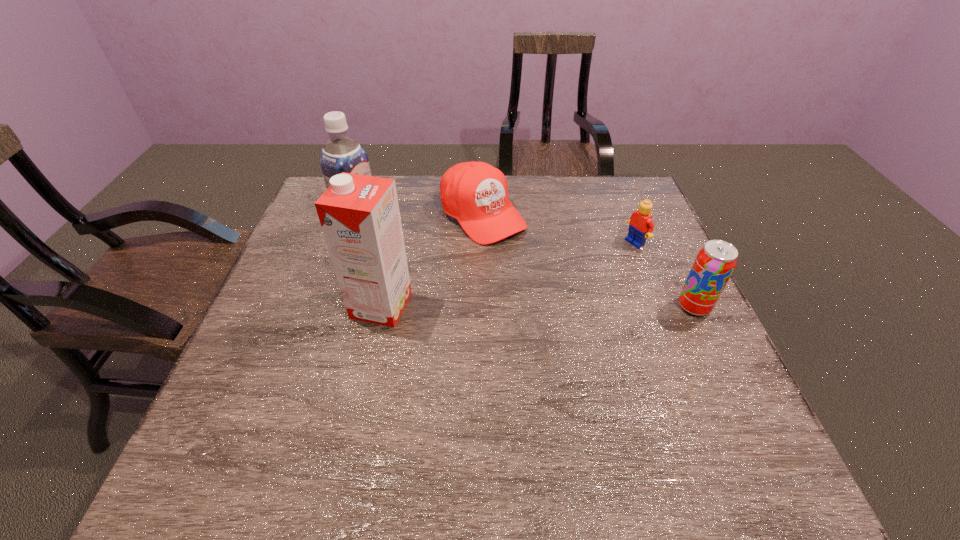
The image size is (960, 540). What are the coordinates of `vacant space on the desktop that is between the carton and the soda can and is positioned on the label of the soya milk` in the screenshot? It's located at (529, 306).

Find the location of a particular element. Image resolution: width=960 pixels, height=540 pixels. free spot on the desktop that is between the carton and the third shortest object and is positioned on the front panel of the third object from right to left is located at coordinates (582, 306).

Locate an element on the screen. The image size is (960, 540). free spot on the desktop that is between the carton and the rightmost object and is positioned on the face of the Lego is located at coordinates (513, 306).